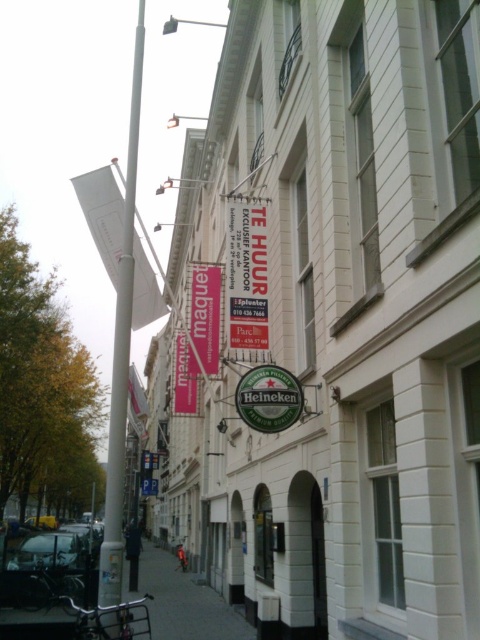
Between white plastic pole at left and gray concrete sidewalk at lower center, which one appears on the right side from the viewer's perspective?

Positioned to the right is gray concrete sidewalk at lower center.

Who is more forward, (132, 273) or (202, 592)?

Positioned in front is point (132, 273).

Find the location of a particular element. The height and width of the screenshot is (640, 480). white plastic pole at left is located at coordinates (121, 353).

Image resolution: width=480 pixels, height=640 pixels. Describe the element at coordinates (339, 321) in the screenshot. I see `white matte signboard at upper center` at that location.

Locate an element on the screen. This screenshot has height=640, width=480. white matte signboard at upper center is located at coordinates (339, 321).

Is point (342, 90) closer to camera compared to point (100, 561)?

No.

Is white matte signboard at upper center further to camera compared to white plastic pole at left?

No, white matte signboard at upper center is in front of white plastic pole at left.

Is point (342, 348) more distant than point (121, 504)?

Yes, point (342, 348) is farther from viewer.

The width and height of the screenshot is (480, 640). Identify the location of white matte signboard at upper center. (339, 321).